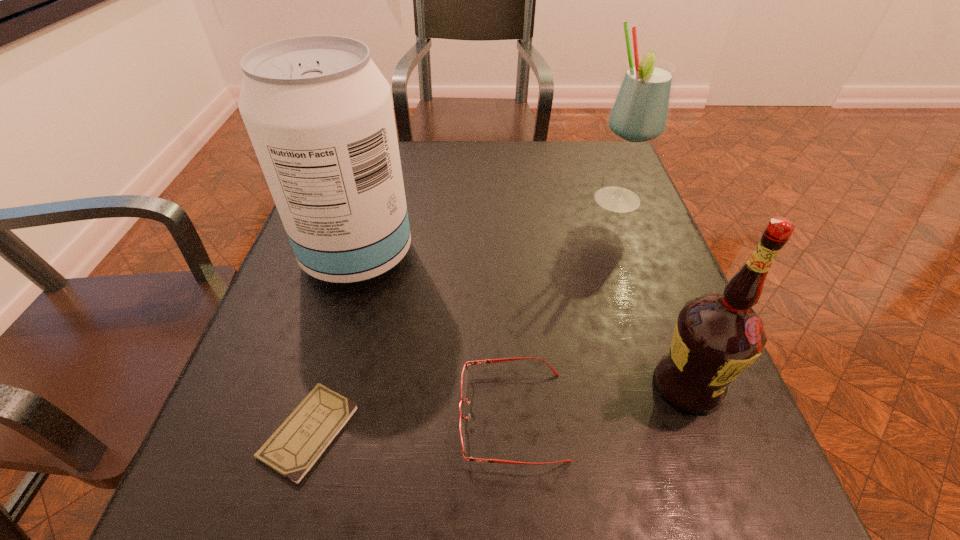
You are a GUI agent. You are given a task and a screenshot of the screen. Output one action in this format:
    pyautogui.click(x=<x>, y=<y>)
    Task: Click on the object positioned at the near left corner
    This screenshot has width=960, height=540.
    Given the screenshot: What is the action you would take?
    pyautogui.click(x=292, y=450)

Identify the location of object situated at the far right corner. Image resolution: width=960 pixels, height=540 pixels. (640, 111).

Where is `vacant area at the far edge of the desktop`? vacant area at the far edge of the desktop is located at coordinates (549, 143).

In the image, there is a desktop. At what (x,y) coordinates should I click in order to perform the action: click on free space at the near edge. Please return your answer as a coordinate pair (x, y). Image resolution: width=960 pixels, height=540 pixels. Looking at the image, I should click on (326, 514).

Locate an element on the screen. vacant space at the left edge is located at coordinates (297, 327).

Where is `vacant area at the right edge of the desktop`? vacant area at the right edge of the desktop is located at coordinates (671, 327).

In the image, there is a desktop. Where is `free space at the near left corner`? This screenshot has height=540, width=960. free space at the near left corner is located at coordinates (194, 521).

Find the location of a particular element. vacant region at the far right corner of the desktop is located at coordinates 595,172.

Image resolution: width=960 pixels, height=540 pixels. Find the location of `vacant space at the near right corner`. vacant space at the near right corner is located at coordinates (700, 476).

Locate an element on the screen. The height and width of the screenshot is (540, 960). unoccupied position between the leftmost alcohol and the fourth tallest object is located at coordinates (435, 335).